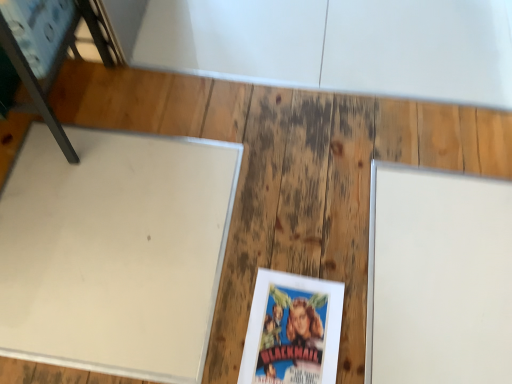
Identify the location of free space below matte paper book at center (from a real-world perspective). (292, 333).